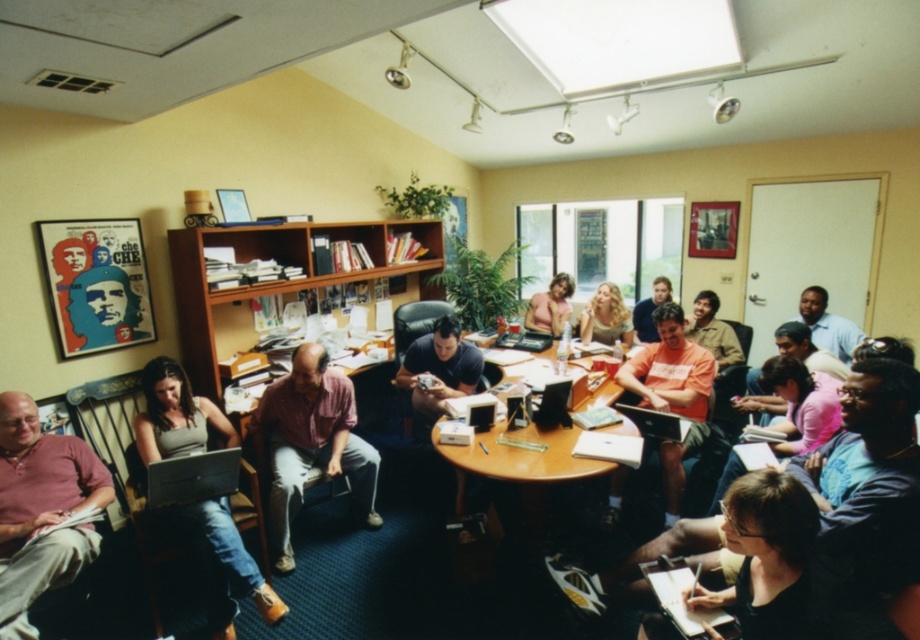
You are organizing a charity event and need to decide which shirt to donate based on their sizes. If the donation criteria require selecting the larger sized clothing, which shirt should you choose between the pink cotton shirt at lower left and the matte black shirt at center?

The pink cotton shirt at lower left has a larger size compared to the matte black shirt at center, so you should choose the pink cotton shirt at lower left for donation.

You are a photographer trying to capture a group photo of the participants at the round wooden table. You notice the blonde hair at center and the matte orange shirt at center. Which object should you adjust to ensure both are fully visible in the frame?

The blonde hair at center has a larger width than the matte orange shirt at center. To ensure both are fully visible, adjust the framing so that there is enough space for the wider blonde hair at center.